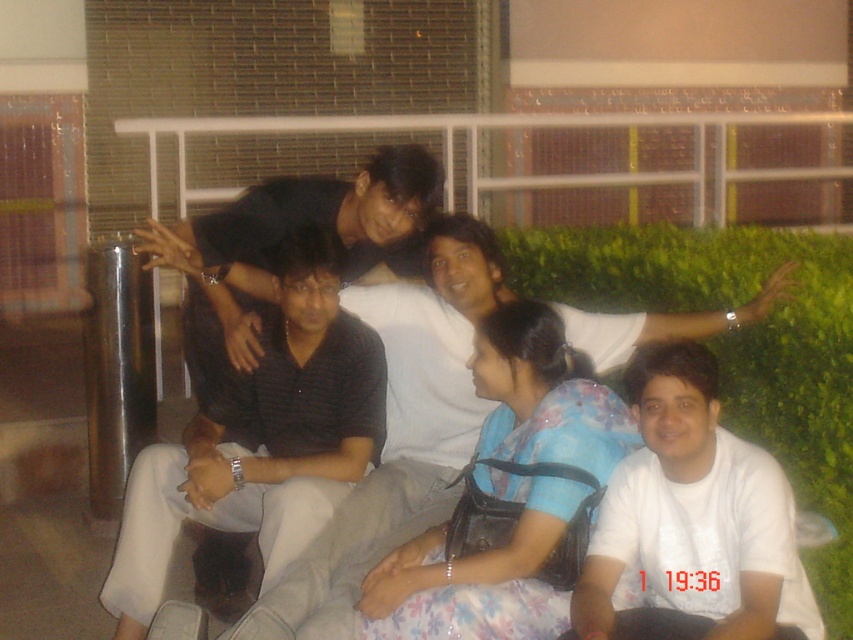
You are a photographer trying to capture a closeup of the white matte shirt at lower right. The camera you are using has a focal length of 50mm. Based on the coordinates provided, can you determine if the shirt is positioned within the standard 36mm width of the camera sensor?

The white matte shirt at lower right is positioned at coordinates point (693, 520). Since the sensor width is 36mm and the coordinate is within the 0mm to 36mm range, the shirt is within the sensor width and can be captured.

You are a photographer trying to capture a candid shot of the dark gray shirt at center and the floral fabric dress at center. Since you want to focus on the subjects in the front, which subject should you aim your camera at to ensure they are in focus?

The dark gray shirt at center should be the focus since it is in front of the floral fabric dress at center.

You are a photographer trying to capture a clear shot of both the dark gray striped shirt at center and the dark gray shirt at center. Since you want to focus on the one closer to you, which one should you aim your camera at?

The dark gray striped shirt at center is closer to you, so you should aim your camera at it to ensure it is in focus.